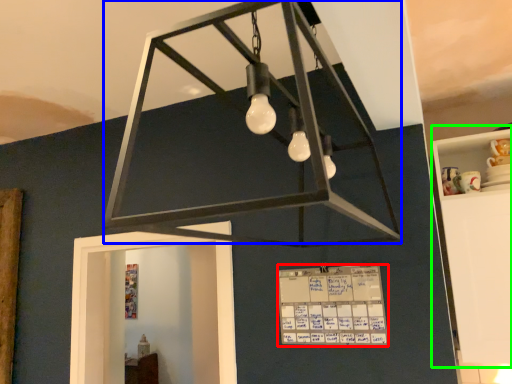
Question: Which object is the farthest from writing (highlighted by a red box)? Choose among these: lamp (highlighted by a blue box) or furniture (highlighted by a green box).

Choices:
 (A) lamp
 (B) furniture

Answer: (B)